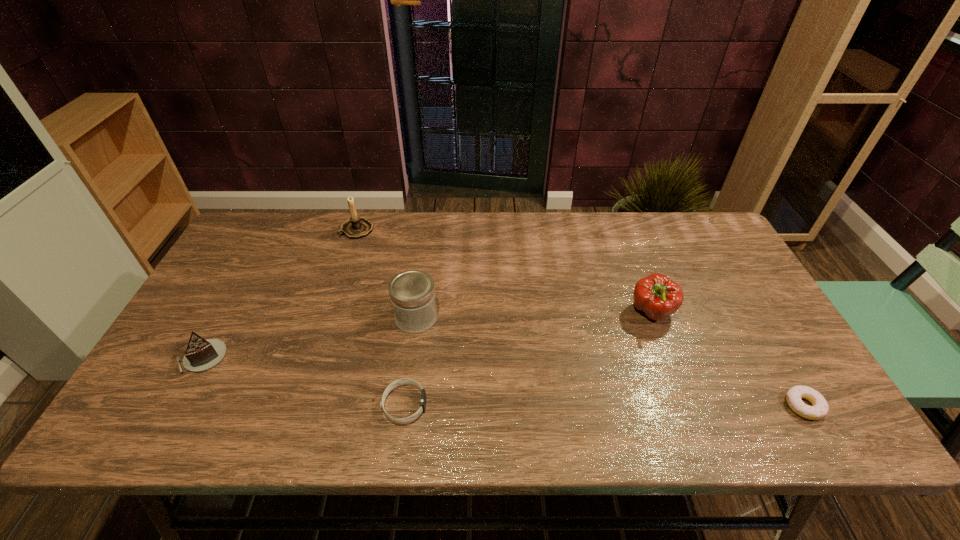
Locate an element on the screen. Image resolution: width=960 pixels, height=540 pixels. vacant region located 0.070m on the right of the jar is located at coordinates (464, 318).

Where is `vacant space located 0.240m on the left of the second object from right to left`? This screenshot has width=960, height=540. vacant space located 0.240m on the left of the second object from right to left is located at coordinates (541, 313).

Image resolution: width=960 pixels, height=540 pixels. What are the coordinates of `vacant space located on the outer surface of the wristband` in the screenshot? It's located at 563,405.

Locate an element on the screen. The image size is (960, 540). free space located 0.220m on the back of the shortest object is located at coordinates (753, 319).

Locate an element on the screen. This screenshot has height=540, width=960. object that is at the far edge is located at coordinates (356, 227).

Image resolution: width=960 pixels, height=540 pixels. I want to click on wristband present at the near edge, so click(405, 381).

In order to click on doughnut located at the near edge in this screenshot , I will do `click(818, 410)`.

At what (x,y) coordinates should I click in order to perform the action: click on object positioned at the left edge. Please return your answer as a coordinate pair (x, y). This screenshot has width=960, height=540. Looking at the image, I should click on (201, 354).

You are a GUI agent. You are given a task and a screenshot of the screen. Output one action in this format:
    pyautogui.click(x=<x>, y=<y>)
    Task: Click on the object that is positioned at the right edge
    
    Given the screenshot: What is the action you would take?
    pyautogui.click(x=818, y=410)

Where is `object located at the near right corner`? The height and width of the screenshot is (540, 960). object located at the near right corner is located at coordinates (818, 410).